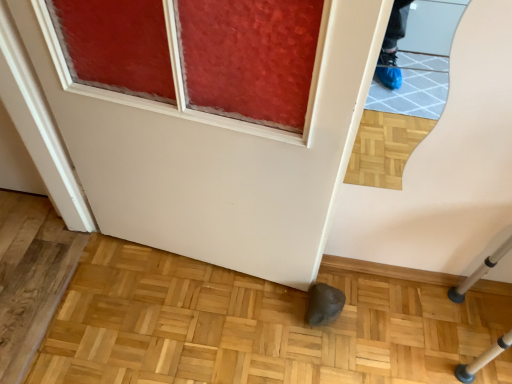
The height and width of the screenshot is (384, 512). What do you see at coordinates (479, 272) in the screenshot? I see `silver metallic crutch at lower right` at bounding box center [479, 272].

Measure the distance between silver metallic crutch at lower right and camera.

silver metallic crutch at lower right is 1.35 meters from camera.

Image resolution: width=512 pixels, height=384 pixels. I want to click on silver metallic crutch at lower right, so click(479, 272).

Where is `silver metallic crutch at lower right`? This screenshot has height=384, width=512. silver metallic crutch at lower right is located at coordinates (479, 272).